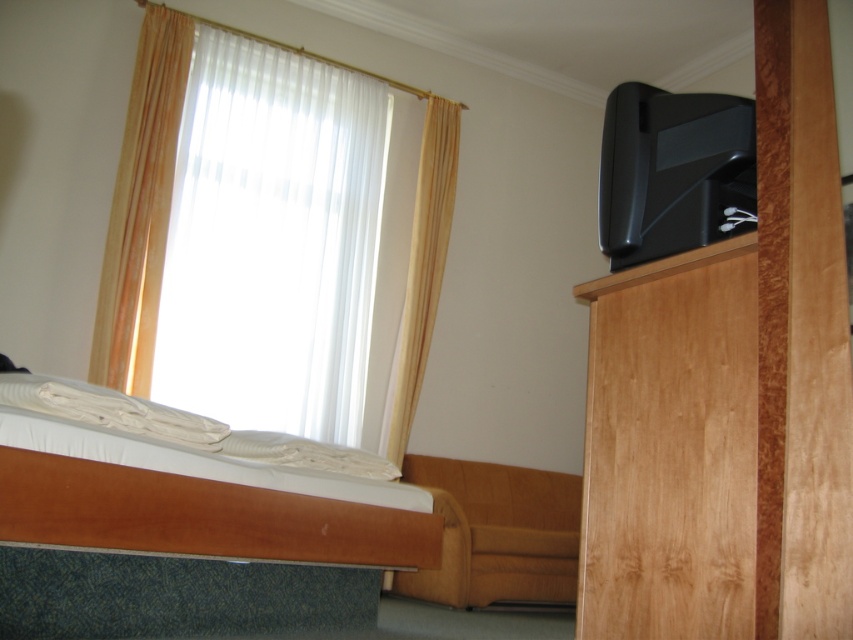
You are a guest in this room and want to watch TV while lying in bed. Which object, the white matte bed at lower left or the white sheer curtain at upper left, is positioned so that you can see the TV more easily?

The white matte bed at lower left is below the white sheer curtain at upper left, so the white sheer curtain at upper left is higher up and might block your view of the TV. Therefore, you should position yourself on the white matte bed at lower left to have a clearer view of the TV.

You are standing in the room and want to open the window behind the curtains. Which curtain should you move first, the white sheer curtain at upper left or the beige fabric curtain at upper left?

The white sheer curtain at upper left is positioned on the left side of beige fabric curtain at upper left, so you should move the white sheer curtain at upper left first to access the window.